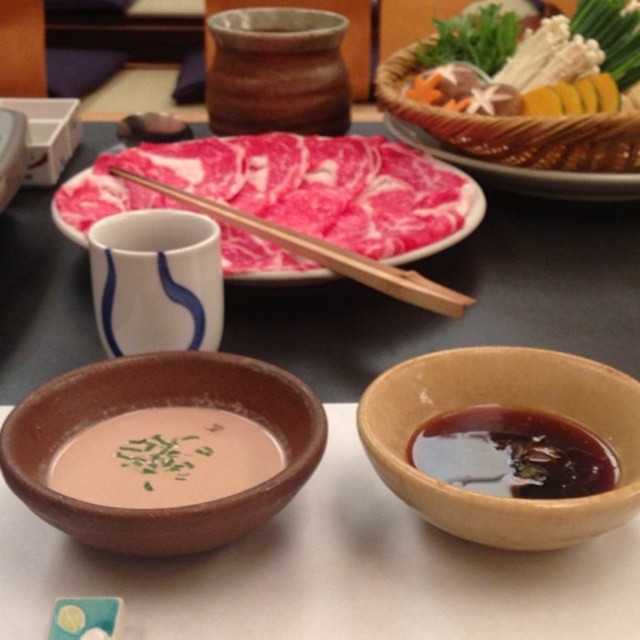
You are preparing to serve food and need to place the smooth wooden skewers at upper right and the smooth wooden platter at center on a table. The table has a 4 inch wide shelf. Can both items fit side by side on the shelf without overlapping?

The smooth wooden skewers at upper right is 3.91 inches from the smooth wooden platter at center. Since the distance between them is less than the 4 inch shelf width, they can fit side by side without overlapping.

You are a guest at a dinner and need to choose between the brown clay bowl at lower left and the matte brown bowl at center for your soup. Which bowl should you pick if you want a taller container?

The brown clay bowl at lower left is much taller than the matte brown bowl at center, so you should choose the brown clay bowl at lower left for a taller container.

Based on the photo, you are setting up a table for a dinner party and have two bowls to place. The brown clay bowl at lower left and the matte brown bowl at center. If you want to serve a main dish that requires a larger surface area, which bowl should you choose?

The brown clay bowl at lower left has a larger width than the matte brown bowl at center, so it is better suited for serving the main dish that requires a larger surface area.